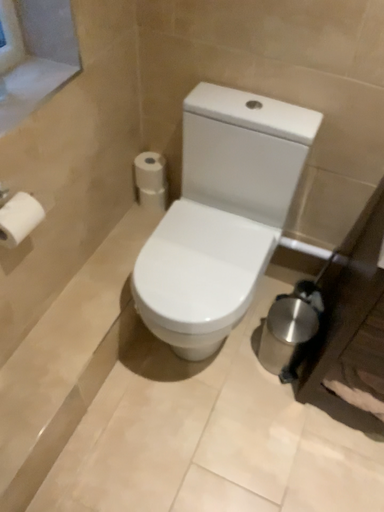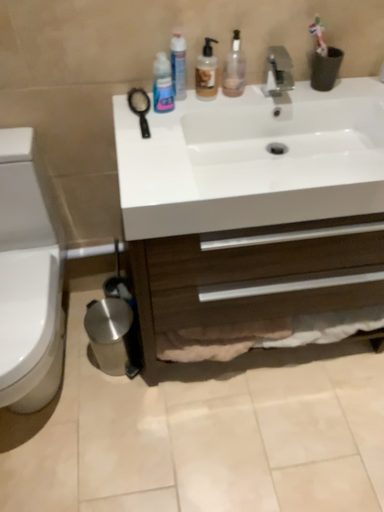
Question: Which way did the camera rotate in the video?

Choices:
 (A) rotated right
 (B) rotated left

Answer: (A)